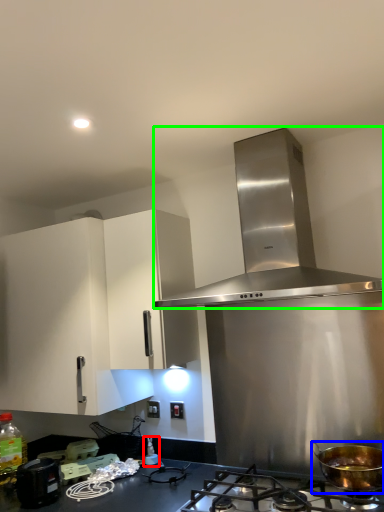
Question: Estimate the real-world distances between objects in this image. Which object is closer to bottle (highlighted by a red box), kitchen appliance (highlighted by a blue box) or home appliance (highlighted by a green box)?

Choices:
 (A) kitchen appliance
 (B) home appliance

Answer: (A)